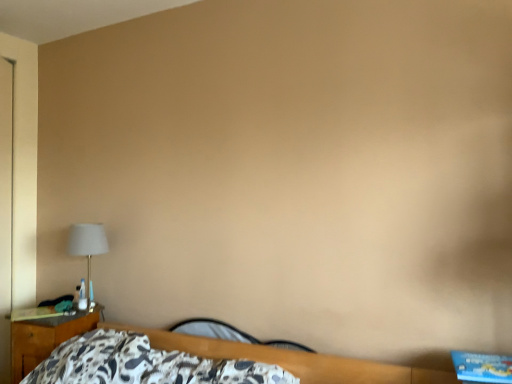
The width and height of the screenshot is (512, 384). Identify the location of free point above black leather guitar at lower center (from a real-world perspective). (244, 319).